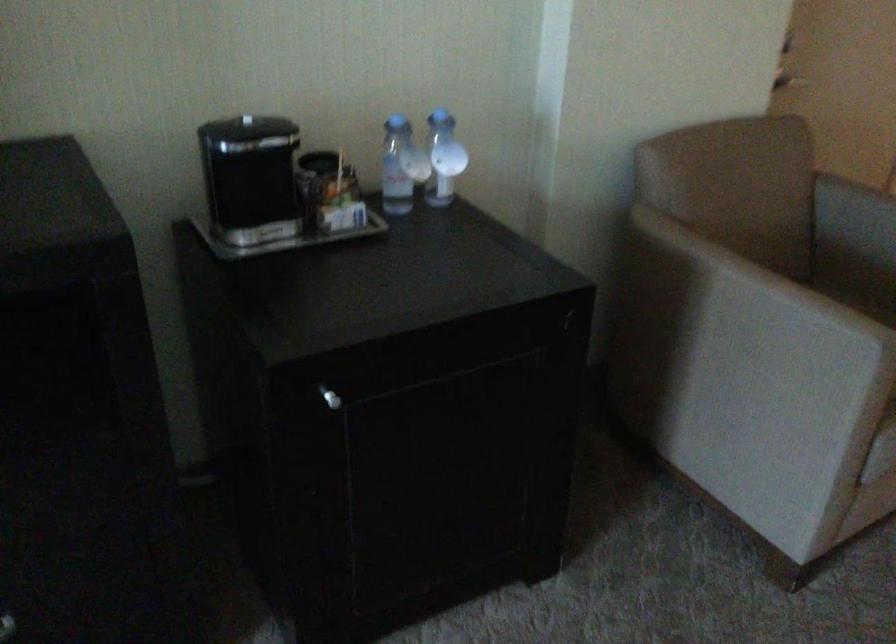
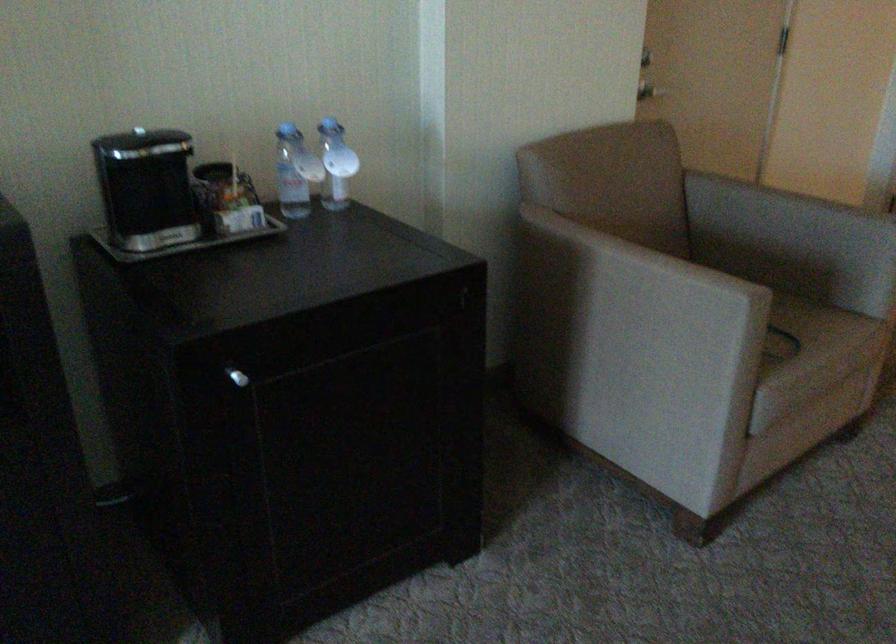
Locate, in the second image, the point that corresponds to [401,169] in the first image.

(295, 172)